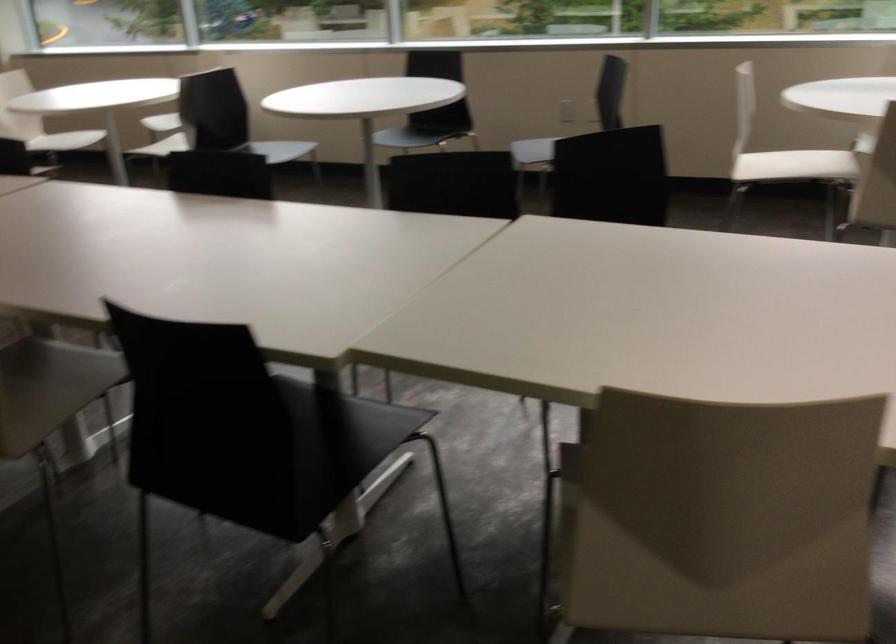
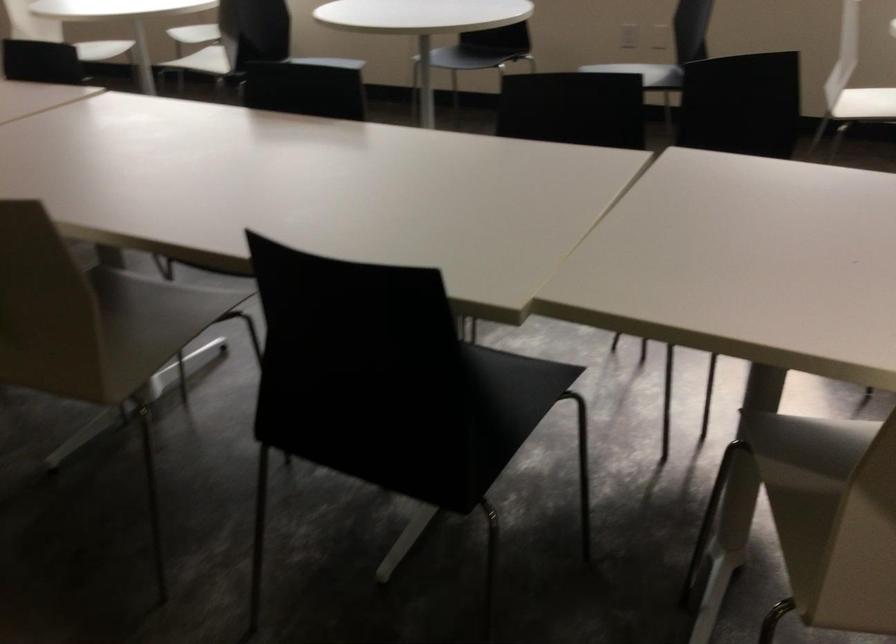
Question: The images are taken continuously from a first-person perspective. In which direction is your viewpoint rotating?

Choices:
 (A) Left
 (B) Right
 (C) Up
 (D) Down

Answer: (D)